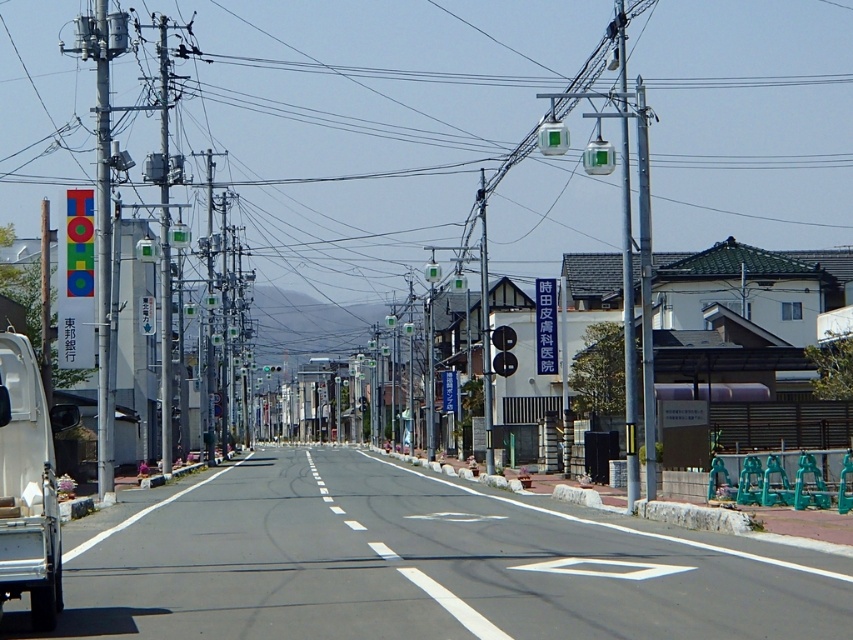
You are a delivery driver who needs to pass through the intersection ahead. You see the white matte truck at left and the black plastic traffic light at center. Which object is closer to the left edge of the road?

The white matte truck at left is positioned on the left side of the black plastic traffic light at center, so it is closer to the left edge of the road.

You are a city planner analyzing this street scene. You need to determine if the metallic gray pole at left can support a new traffic light similar in size to the black plastic traffic light at center. Based on the scene description, what is your conclusion?

The metallic gray pole at left is larger in size than the black plastic traffic light at center, so it can support a traffic light of that size.